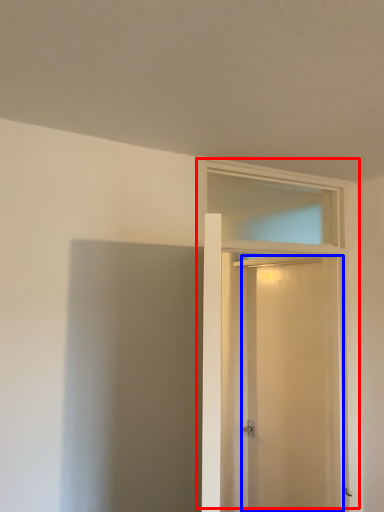
Question: Which object is closer to the camera taking this photo, door (highlighted by a red box) or screen door (highlighted by a blue box)?

Choices:
 (A) door
 (B) screen door

Answer: (A)